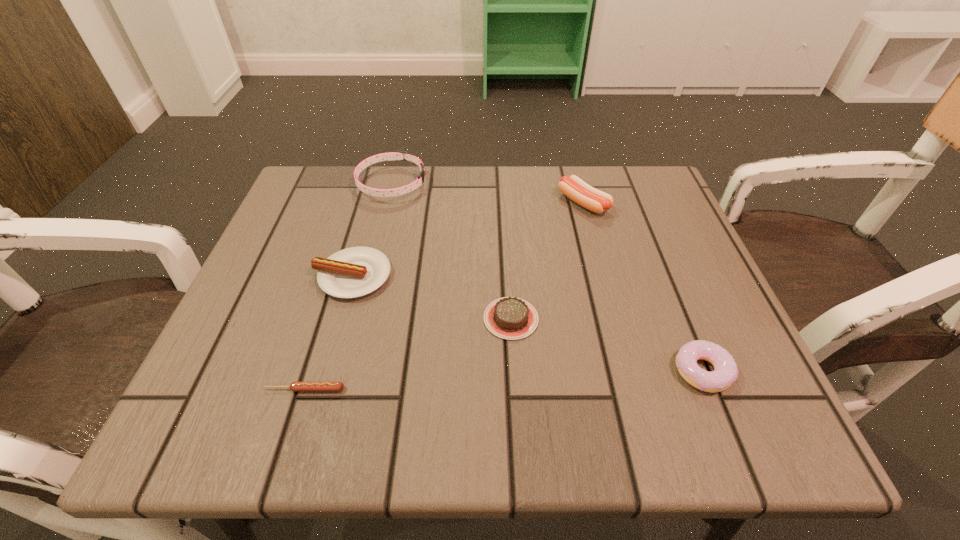
Locate an element on the screen. dog collar is located at coordinates (397, 154).

Where is `the tallest sausage`? This screenshot has width=960, height=540. the tallest sausage is located at coordinates (573, 187).

Find the location of a particular element. The height and width of the screenshot is (540, 960). the fifth object from left to right is located at coordinates (573, 187).

The image size is (960, 540). In order to click on the second shortest sausage in this screenshot , I will do `click(353, 272)`.

The height and width of the screenshot is (540, 960). Find the location of `the rightmost object`. the rightmost object is located at coordinates (725, 372).

The image size is (960, 540). In order to click on chocolate cake in this screenshot , I will do `click(511, 318)`.

Identify the location of the third object from right to left. (511, 318).

This screenshot has width=960, height=540. Identify the location of the nearest sausage. (294, 386).

Identify the location of the shortest object. Image resolution: width=960 pixels, height=540 pixels. (294, 386).

In order to click on free spot located with the buckle on the dog collar in this screenshot , I will do `click(531, 184)`.